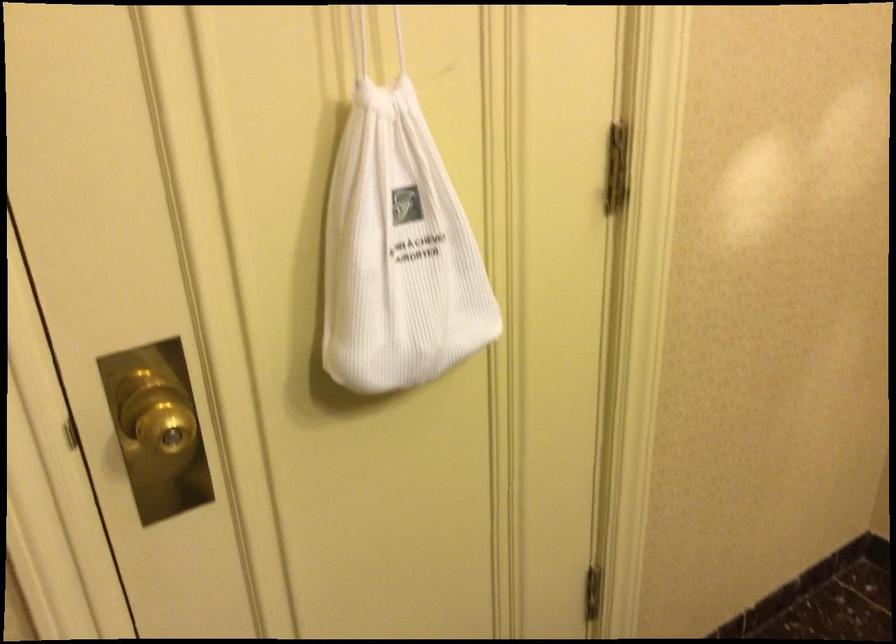
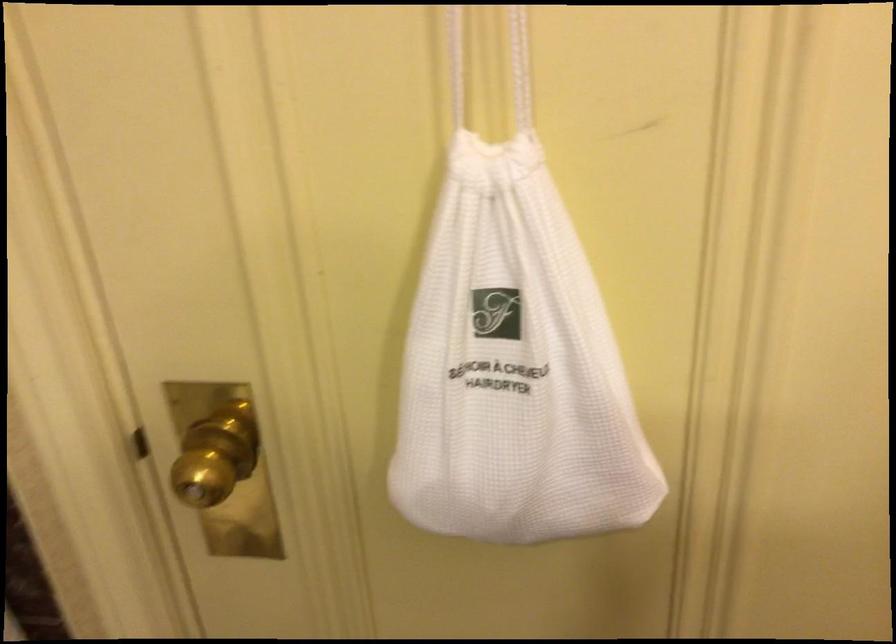
Question: The first image is from the beginning of the video and the second image is from the end. How did the camera likely rotate when shooting the video?

Choices:
 (A) Left
 (B) Right
 (C) Up
 (D) Down

Answer: (A)